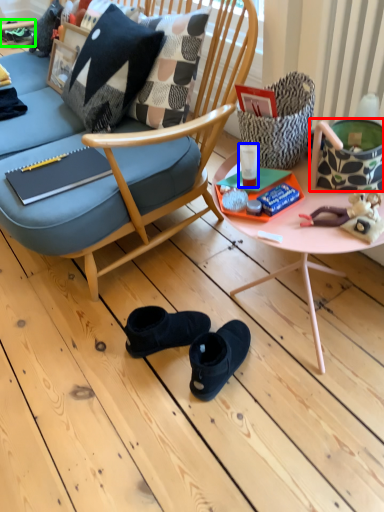
Question: Which object is positioned farthest from handbag (highlighted by a red box)? Select from coffee cup (highlighted by a blue box) and footwear (highlighted by a green box).

Choices:
 (A) coffee cup
 (B) footwear

Answer: (B)